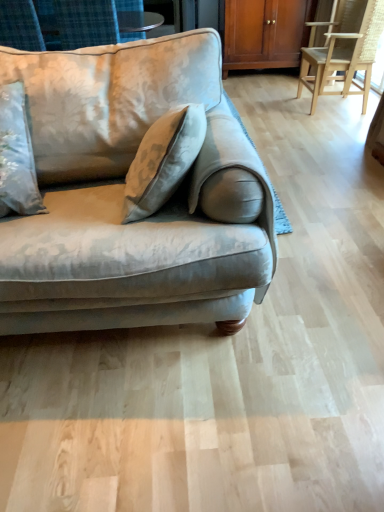
Question: Considering the relative positions of light brown wooden chair at right and velvet beige couch at left in the image provided, is light brown wooden chair at right to the right of velvet beige couch at left from the viewer's perspective?

Choices:
 (A) no
 (B) yes

Answer: (B)

Question: Are light brown wooden chair at right and velvet beige couch at left beside each other?

Choices:
 (A) yes
 (B) no

Answer: (B)

Question: Does light brown wooden chair at right have a lesser height compared to velvet beige couch at left?

Choices:
 (A) no
 (B) yes

Answer: (B)

Question: From a real-world perspective, does light brown wooden chair at right sit lower than velvet beige couch at left?

Choices:
 (A) yes
 (B) no

Answer: (A)

Question: From a real-world perspective, does light brown wooden chair at right stand above velvet beige couch at left?

Choices:
 (A) no
 (B) yes

Answer: (A)

Question: From the image's perspective, would you say light brown wooden chair at right is shown under velvet beige couch at left?

Choices:
 (A) yes
 (B) no

Answer: (B)

Question: Are velvet beige couch at left and light brown wooden chair at right located far from each other?

Choices:
 (A) yes
 (B) no

Answer: (A)

Question: Are velvet beige couch at left and light brown wooden chair at right making contact?

Choices:
 (A) yes
 (B) no

Answer: (B)

Question: From the image's perspective, would you say velvet beige couch at left is shown under light brown wooden chair at right?

Choices:
 (A) no
 (B) yes

Answer: (B)

Question: Is velvet beige couch at left bigger than light brown wooden chair at right?

Choices:
 (A) no
 (B) yes

Answer: (B)

Question: Considering the relative positions of velvet beige couch at left and light brown wooden chair at right in the image provided, is velvet beige couch at left in front of light brown wooden chair at right?

Choices:
 (A) no
 (B) yes

Answer: (B)

Question: Does velvet beige couch at left appear on the right side of light brown wooden chair at right?

Choices:
 (A) yes
 (B) no

Answer: (B)

Question: Considering the relative positions of velvet beige couch at left and wooden cabinet at upper center in the image provided, is velvet beige couch at left to the right of wooden cabinet at upper center from the viewer's perspective?

Choices:
 (A) no
 (B) yes

Answer: (A)